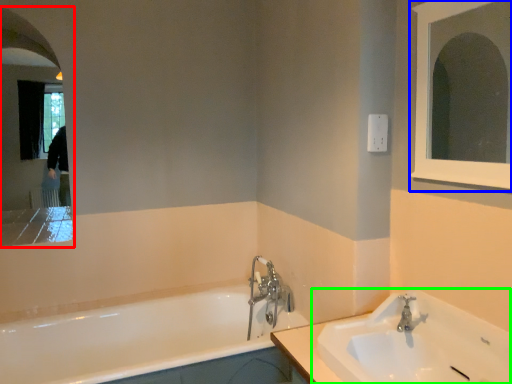
Question: Which is nearer to the medicine cabinet (highlighted by a red box)? medicine cabinet (highlighted by a blue box) or sink (highlighted by a green box).

Choices:
 (A) medicine cabinet
 (B) sink

Answer: (B)